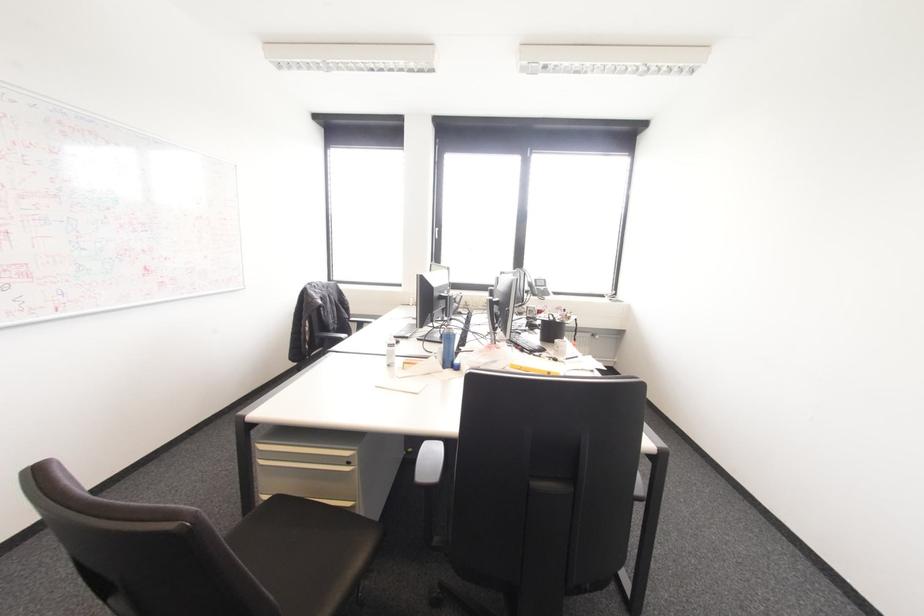
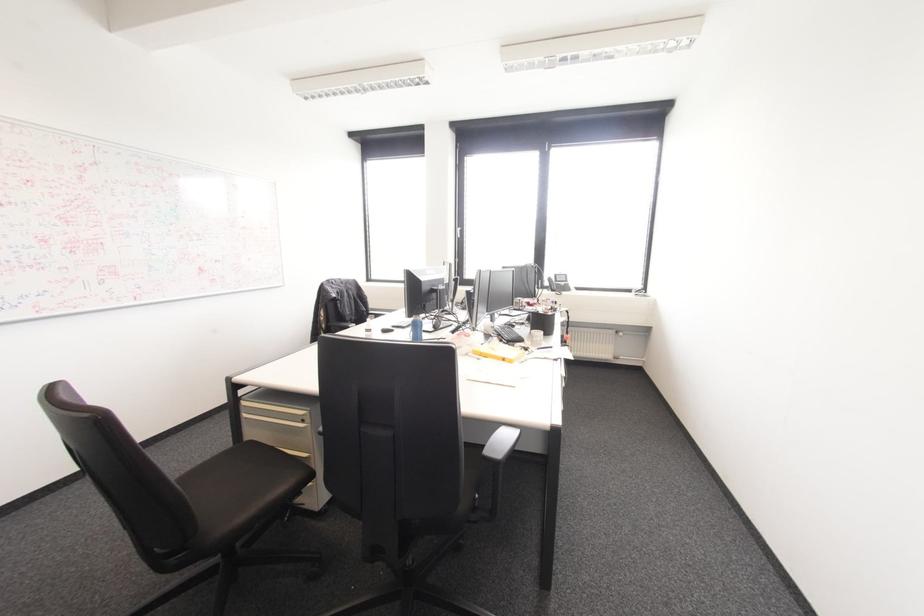
The point at (359, 560) is marked in the first image. Where is the corresponding point in the second image?

(281, 488)